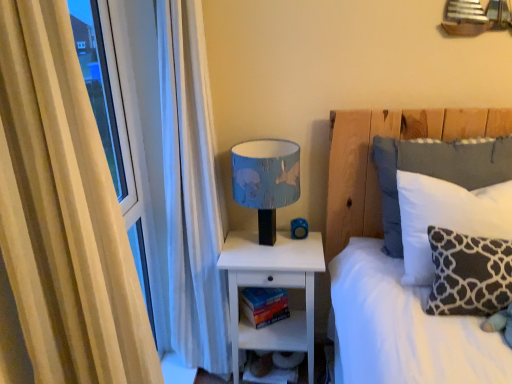
The image size is (512, 384). I want to click on vacant space underneath blue fabric lampshade at upper right (from a real-world perspective), so (263, 250).